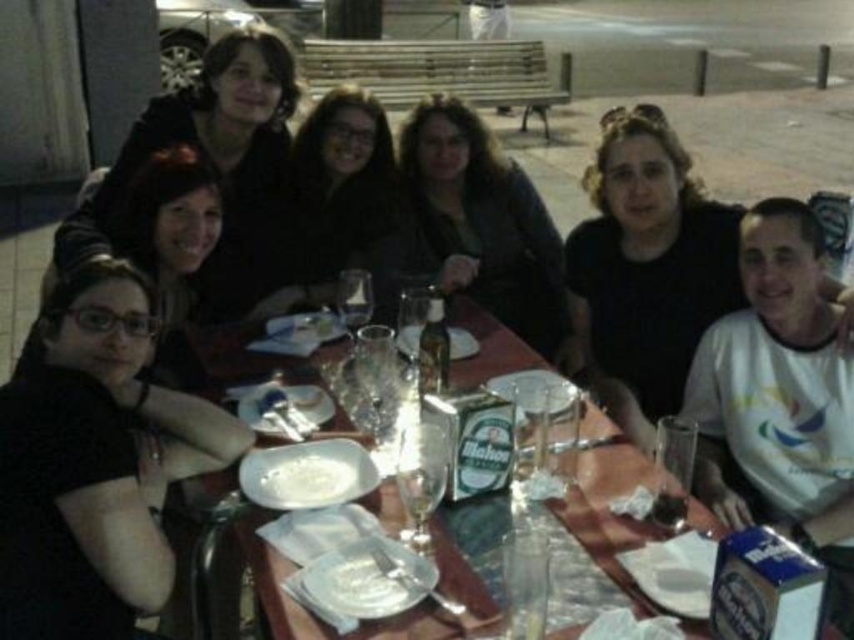
Question: Which is farther from the white creamy food at center?

Choices:
 (A) dark brown leather jacket at center
 (B) wooden table at center
 (C) matte black shirt at center

Answer: (A)

Question: Which point appears closest to the camera in this image?

Choices:
 (A) (297, 483)
 (B) (610, 438)
 (C) (10, 595)
 (D) (361, 252)

Answer: (C)

Question: Is matte black jacket at center below white creamy food at center?

Choices:
 (A) no
 (B) yes

Answer: (A)

Question: Is matte black shirt at upper left thinner than white creamy food at center?

Choices:
 (A) no
 (B) yes

Answer: (A)

Question: Which object is the closest to the matte black shirt at upper left?

Choices:
 (A) matte black shirt at center
 (B) dark brown leather jacket at center
 (C) black matte shirt at lower left
 (D) wooden table at center

Answer: (D)

Question: Can you confirm if matte black shirt at center is thinner than dark brown leather jacket at center?

Choices:
 (A) no
 (B) yes

Answer: (B)